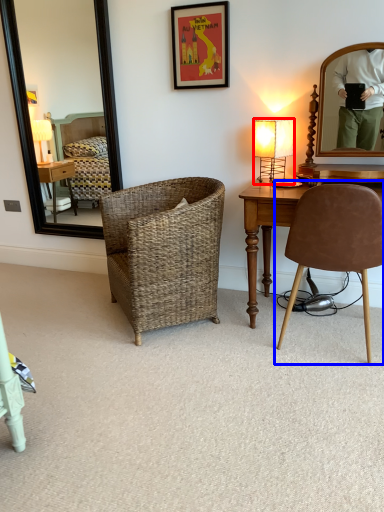
Question: Among these objects, which one is farthest to the camera, lamp (highlighted by a red box) or chair (highlighted by a blue box)?

Choices:
 (A) lamp
 (B) chair

Answer: (A)